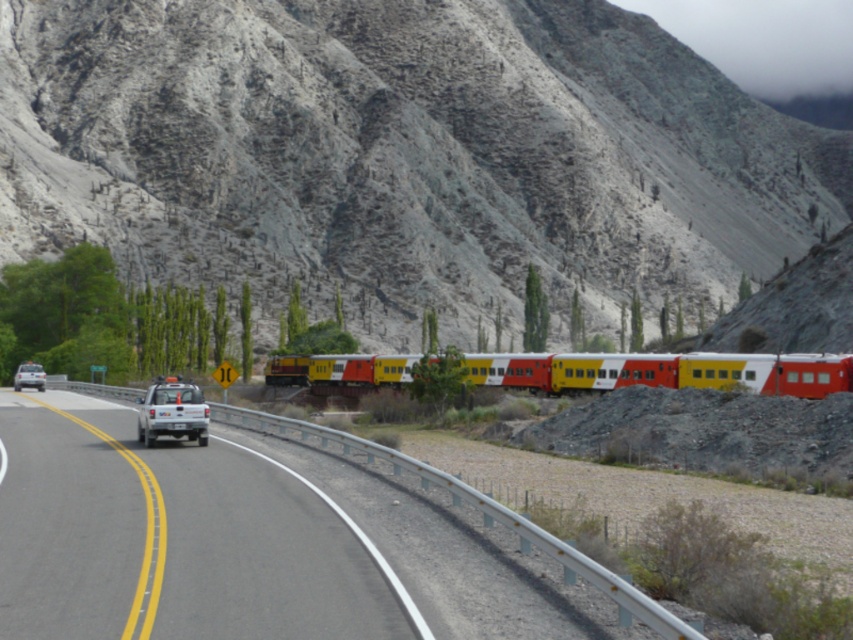
Question: Can you confirm if rugged stone mountain at center is positioned to the left of yellow matte train at center?

Choices:
 (A) yes
 (B) no

Answer: (B)

Question: Can you confirm if white glossy pickup truck at center is positioned above metallic train track at center?

Choices:
 (A) yes
 (B) no

Answer: (B)

Question: Among these points, which one is nearest to the camera?

Choices:
 (A) (39, 372)
 (B) (589, 576)
 (C) (177, 400)
 (D) (279, 376)

Answer: (B)

Question: Is rugged stone mountain at center in front of white glossy pickup truck at center?

Choices:
 (A) no
 (B) yes

Answer: (A)

Question: Which is farther from the yellow matte train at center?

Choices:
 (A) rugged stone mountain at center
 (B) white matte car at left
 (C) white glossy pickup truck at center
 (D) metallic train track at center

Answer: (A)

Question: Which point is closer to the camera?

Choices:
 (A) white glossy pickup truck at center
 (B) rugged stone mountain at center
 (C) yellow matte train at center
 (D) metallic train track at center

Answer: (D)